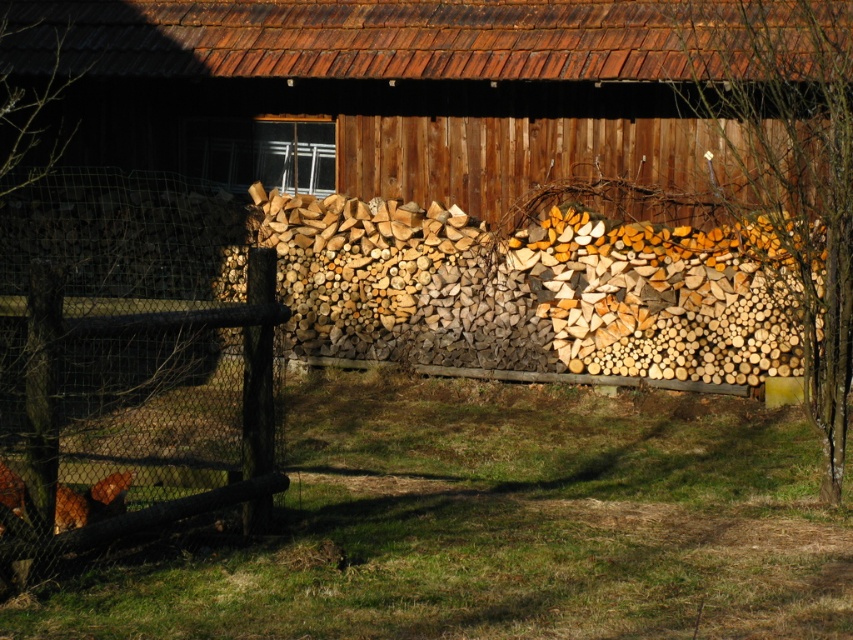
Does wooden at center have a greater width compared to brown wooden fence at left?

Correct, the width of wooden at center exceeds that of brown wooden fence at left.

Does wooden at center lie behind brown wooden fence at left?

Yes, it is.

Between point (0, 13) and point (35, 456), which one is positioned behind?

The point (0, 13) is more distant.

This screenshot has width=853, height=640. I want to click on wooden at center, so click(x=447, y=92).